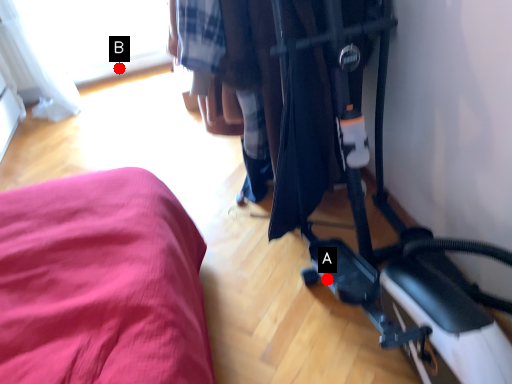
Question: Two points are circled on the image, labeled by A and B beside each circle. Among these points, which one is farthest from the camera?

Choices:
 (A) A is further
 (B) B is further

Answer: (B)